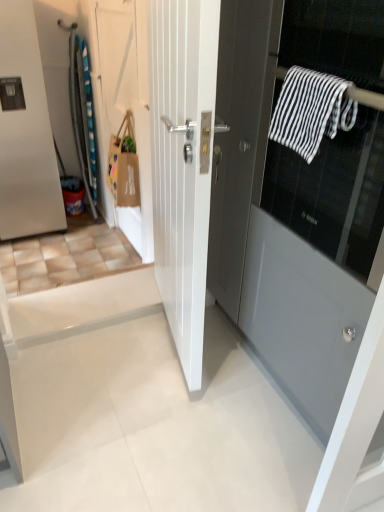
Question: Which direction should I rotate to look at matte gray door at center, which is the first door in right-to-left order?

Choices:
 (A) left
 (B) right

Answer: (B)

Question: Is matte gray door at center, the 4th door positioned from the left, wider than brown paper bag at upper left?

Choices:
 (A) yes
 (B) no

Answer: (A)

Question: Can we say matte gray door at center, which is the first door in right-to-left order, lies outside brown paper bag at upper left?

Choices:
 (A) no
 (B) yes

Answer: (B)

Question: Can you confirm if matte gray door at center, the 4th door positioned from the left, is bigger than brown paper bag at upper left?

Choices:
 (A) no
 (B) yes

Answer: (B)

Question: Is matte gray door at center, which is the first door in right-to-left order, positioned in front of brown paper bag at upper left?

Choices:
 (A) yes
 (B) no

Answer: (A)

Question: Can you confirm if matte gray door at center, the 4th door positioned from the left, is shorter than brown paper bag at upper left?

Choices:
 (A) yes
 (B) no

Answer: (B)

Question: From the image's perspective, would you say matte gray door at center, the 4th door positioned from the left, is positioned over brown paper bag at upper left?

Choices:
 (A) no
 (B) yes

Answer: (A)

Question: Is matte gray door at center, which is the first door in right-to-left order, looking in the opposite direction of white matte door at upper left, placed as the 2th door when sorted from left to right?

Choices:
 (A) yes
 (B) no

Answer: (B)

Question: Is matte gray door at center, the 4th door positioned from the left, in front of white matte door at upper left, placed as the 2th door when sorted from left to right?

Choices:
 (A) yes
 (B) no

Answer: (A)

Question: Does matte gray door at center, which is the first door in right-to-left order, have a lesser width compared to white matte door at upper left, placed as the 2th door when sorted from left to right?

Choices:
 (A) no
 (B) yes

Answer: (A)

Question: Is matte gray door at center, which is the first door in right-to-left order, positioned far away from white matte door at upper left, which appears as the 3th door when viewed from the right?

Choices:
 (A) no
 (B) yes

Answer: (B)

Question: Would you say matte gray door at center, the 4th door positioned from the left, contains white matte door at upper left, which appears as the 3th door when viewed from the right?

Choices:
 (A) yes
 (B) no

Answer: (B)

Question: Can you confirm if matte gray door at center, the 4th door positioned from the left, is bigger than white matte door at upper left, placed as the 2th door when sorted from left to right?

Choices:
 (A) yes
 (B) no

Answer: (A)

Question: Considering the relative positions of matte gray door at center, the 4th door positioned from the left, and black and white striped towel at upper right in the image provided, is matte gray door at center, the 4th door positioned from the left, to the left of black and white striped towel at upper right from the viewer's perspective?

Choices:
 (A) yes
 (B) no

Answer: (B)